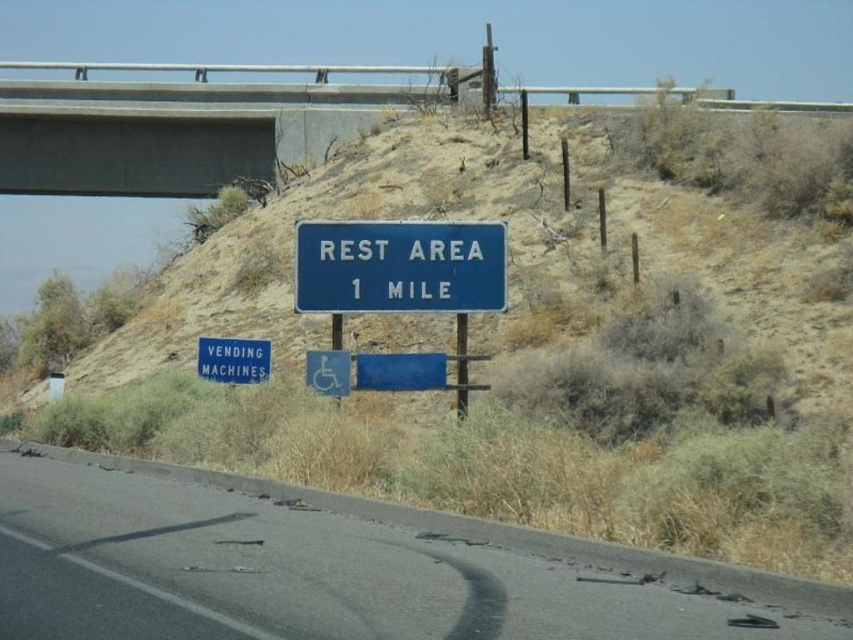
Question: Considering the relative positions of black asphalt road at lower center and blue metallic vending machines at lower left in the image provided, where is black asphalt road at lower center located with respect to blue metallic vending machines at lower left?

Choices:
 (A) left
 (B) right

Answer: (B)

Question: Which point appears closest to the camera in this image?

Choices:
 (A) (213, 369)
 (B) (378, 308)
 (C) (9, 561)
 (D) (311, 118)

Answer: (C)

Question: Is concrete at upper center positioned behind blue metallic vending machines at lower left?

Choices:
 (A) no
 (B) yes

Answer: (B)

Question: Which is farther from the blue metallic sign at center?

Choices:
 (A) concrete at upper center
 (B) blue metallic vending machines at lower left

Answer: (A)

Question: Which of the following is the farthest from the observer?

Choices:
 (A) 268,125
 (B) 233,344
 (C) 341,253
 (D) 618,614

Answer: (A)

Question: Does black asphalt road at lower center appear over concrete at upper center?

Choices:
 (A) yes
 (B) no

Answer: (B)